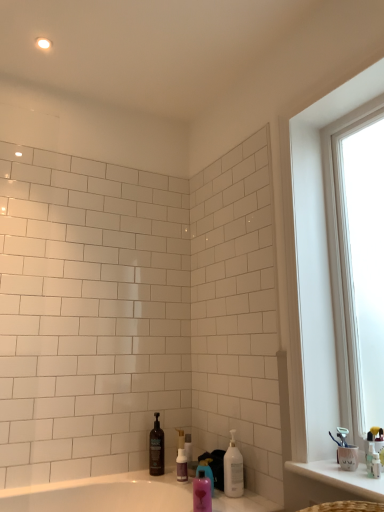
Question: Does white glossy pump bottle at lower center, placed as the third cleaning product when sorted from left to right, turn towards white plastic toothbrush at right, the 3th toiletry when ordered from back to front?

Choices:
 (A) no
 (B) yes

Answer: (A)

Question: Is white plastic toothbrush at right, the 1th toiletry in the front-to-back sequence, at the back of white glossy pump bottle at lower center, which appears as the 3th cleaning product when viewed from the back?

Choices:
 (A) no
 (B) yes

Answer: (A)

Question: Is white glossy pump bottle at lower center, which appears as the 3th cleaning product when viewed from the back, thinner than white plastic toothbrush at right, the 1th toiletry in the front-to-back sequence?

Choices:
 (A) yes
 (B) no

Answer: (B)

Question: Is white glossy pump bottle at lower center, the first cleaning product from the front, located outside white plastic toothbrush at right, which is the first toiletry in right-to-left order?

Choices:
 (A) yes
 (B) no

Answer: (A)

Question: From a real-world perspective, is white glossy pump bottle at lower center, placed as the third cleaning product when sorted from left to right, physically below white plastic toothbrush at right, which is the first toiletry in right-to-left order?

Choices:
 (A) no
 (B) yes

Answer: (B)

Question: Can you confirm if white glossy pump bottle at lower center, which appears as the 3th cleaning product when viewed from the back, is smaller than white plastic toothbrush at right, arranged as the third toiletry when viewed from the left?

Choices:
 (A) yes
 (B) no

Answer: (B)

Question: Considering the relative sizes of transparent glass window at right and white glossy pump bottle at lower center, which appears as the 3th cleaning product when viewed from the back, in the image provided, is transparent glass window at right thinner than white glossy pump bottle at lower center, which appears as the 3th cleaning product when viewed from the back,?

Choices:
 (A) yes
 (B) no

Answer: (B)

Question: Could you tell me if transparent glass window at right is turned towards white glossy pump bottle at lower center, which appears as the 3th cleaning product when viewed from the back?

Choices:
 (A) yes
 (B) no

Answer: (B)

Question: From the image's perspective, is transparent glass window at right over white glossy pump bottle at lower center, placed as the third cleaning product when sorted from left to right?

Choices:
 (A) no
 (B) yes

Answer: (B)

Question: Considering the relative positions of transparent glass window at right and white glossy pump bottle at lower center, which is the first cleaning product in right-to-left order, in the image provided, is transparent glass window at right to the left of white glossy pump bottle at lower center, which is the first cleaning product in right-to-left order, from the viewer's perspective?

Choices:
 (A) yes
 (B) no

Answer: (B)

Question: Does transparent glass window at right come behind white glossy pump bottle at lower center, which appears as the 3th cleaning product when viewed from the back?

Choices:
 (A) yes
 (B) no

Answer: (B)

Question: Is white glossy pump bottle at lower center, which appears as the 3th cleaning product when viewed from the back, located within transparent glass window at right?

Choices:
 (A) no
 (B) yes

Answer: (A)

Question: Is clear plastic bottle at center, arranged as the second toiletry when viewed from the right, outside of white plastic toothbrush at right, arranged as the third toiletry when viewed from the left?

Choices:
 (A) yes
 (B) no

Answer: (A)